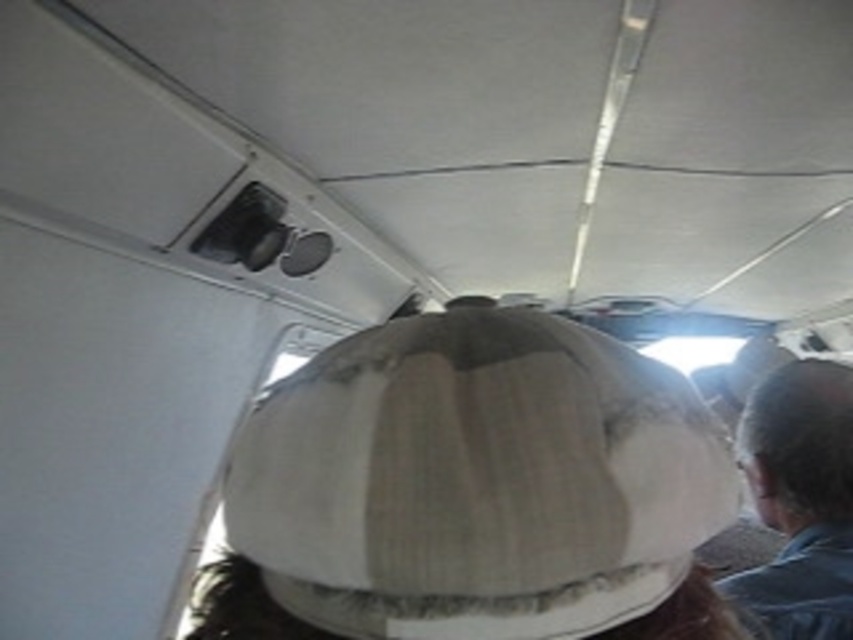
You are seated in the aircraft cabin and want to reach a button located at point (792, 496). There is an obstacle at point (656, 492). Which point is closer to you, the obstacle or the button?

The obstacle at point (656, 492) is closer to you than the button at point (792, 496).

You are a flight attendant checking headwear items in the aircraft cabin. You notice the fuzzy beige baseball hat at center and the gray fabric hat at upper right. Which hat is covering the other one?

The fuzzy beige baseball hat at center is positioned over the gray fabric hat at upper right, so it is covering the gray fabric hat at upper right.